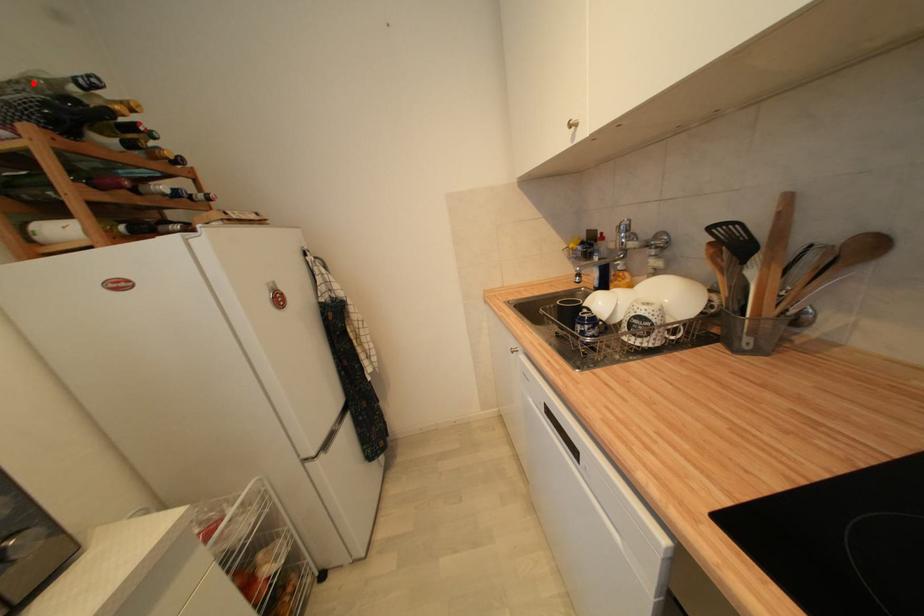
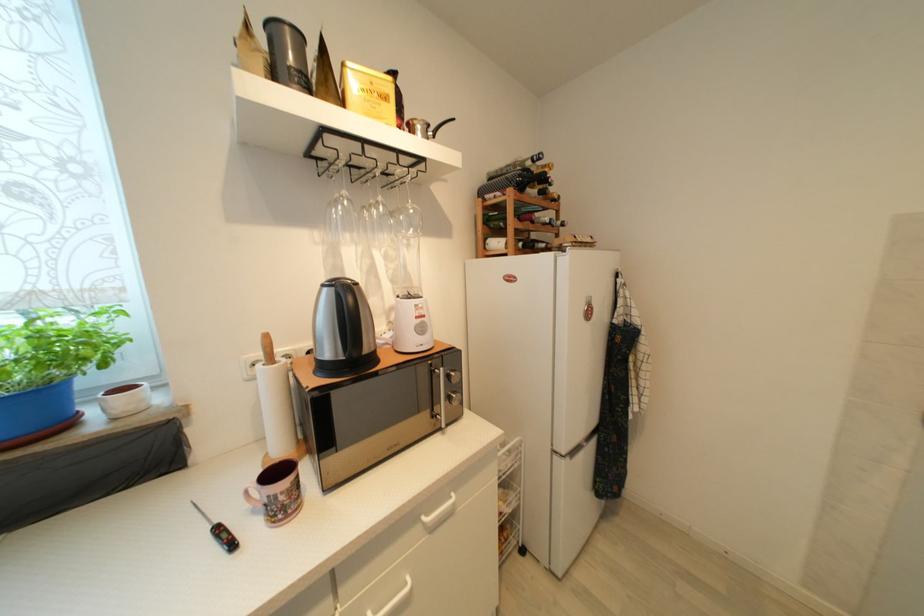
Question: I am providing you with two images of the same scene from different viewpoints. Given a red point in image1, look at the same physical point in image2. Is it:

Choices:
 (A) Closer to the viewpoint
 (B) Farther from the viewpoint

Answer: (A)